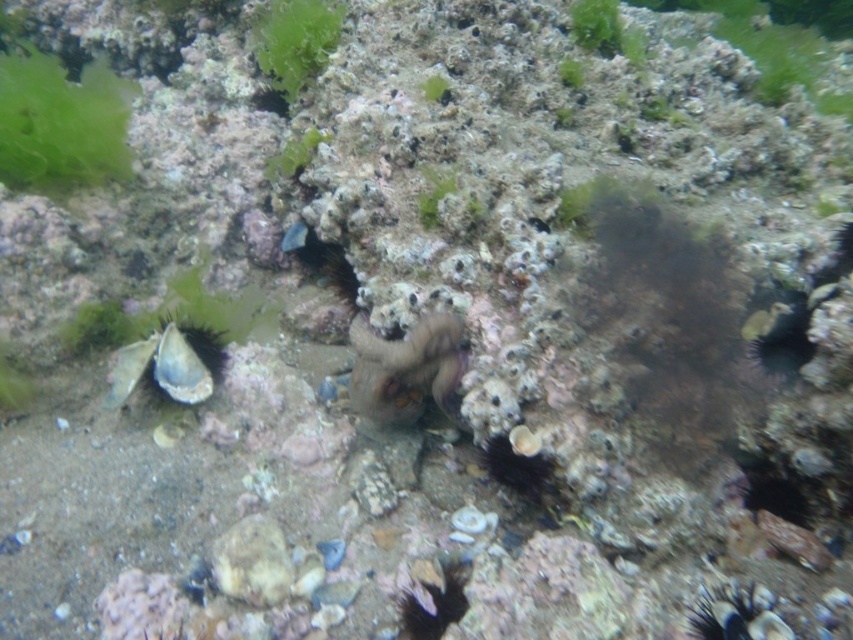
Is purple rubber octopus at center to the right of green matte algae at upper center from the viewer's perspective?

Indeed, purple rubber octopus at center is positioned on the right side of green matte algae at upper center.

Does purple rubber octopus at center have a lesser width compared to green matte algae at upper center?

Correct, purple rubber octopus at center's width is less than green matte algae at upper center's.

Does point (360, 394) lie behind point (308, 1)?

No, (360, 394) is in front of (308, 1).

You are a GUI agent. You are given a task and a screenshot of the screen. Output one action in this format:
    pyautogui.click(x=<x>, y=<y>)
    Task: Click on the purple rubber octopus at center
    This screenshot has width=853, height=640.
    Given the screenshot: What is the action you would take?
    pyautogui.click(x=405, y=369)

Is purple rubber octopus at center in front of blue spiky shell at lower left?

Yes, purple rubber octopus at center is in front of blue spiky shell at lower left.

Is purple rubber octopus at center below blue spiky shell at lower left?

Indeed, purple rubber octopus at center is positioned under blue spiky shell at lower left.

I want to click on purple rubber octopus at center, so click(405, 369).

Between blue spiky shell at lower left and green matte algae at upper center, which one has less height?

Standing shorter between the two is blue spiky shell at lower left.

This screenshot has height=640, width=853. What are the coordinates of `blue spiky shell at lower left` in the screenshot? It's located at (169, 364).

This screenshot has width=853, height=640. Find the location of `blue spiky shell at lower left`. blue spiky shell at lower left is located at coordinates (169, 364).